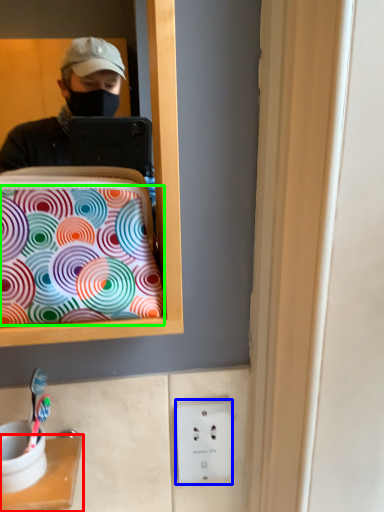
Question: Based on their relative distances, which object is nearer to furniture (highlighted by a red box)? Choose from electric outlet (highlighted by a blue box) and pattern (highlighted by a green box).

Choices:
 (A) electric outlet
 (B) pattern

Answer: (A)